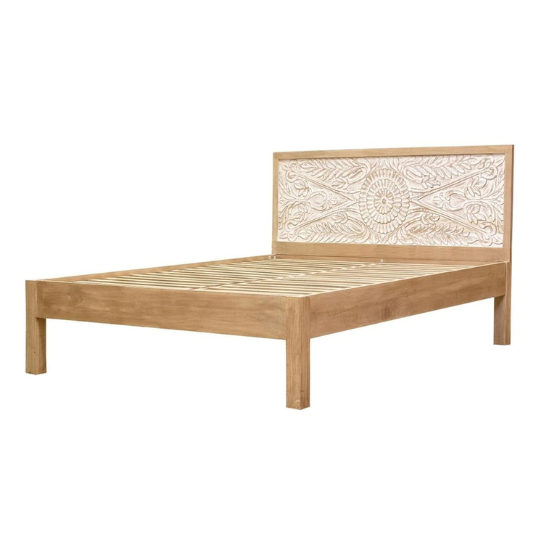
Find the location of `empty space below bed frame`. empty space below bed frame is located at coordinates (285, 457).